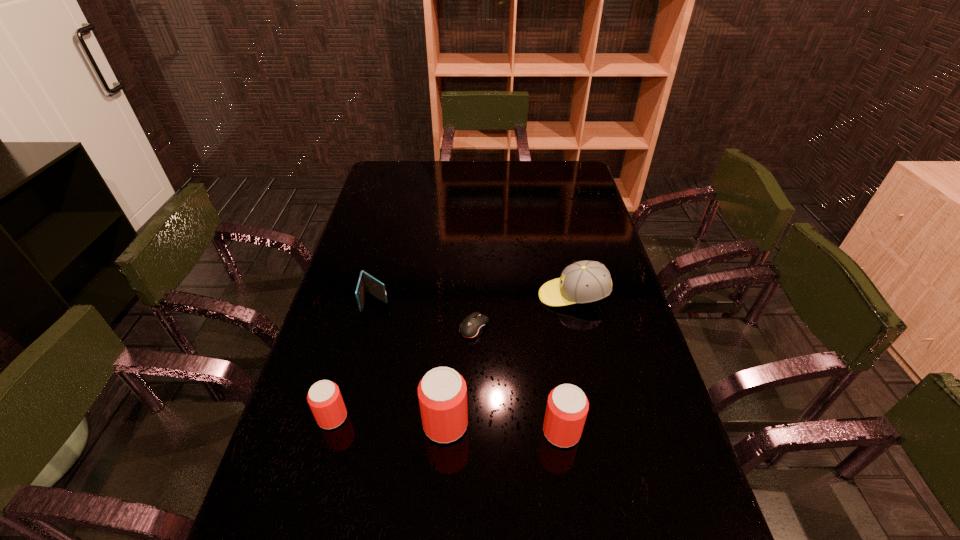
At what (x,y) coordinates should I click in order to perform the action: click on empty location between the wallet and the second tallest beer can. Please return your answer as a coordinate pair (x, y). Looking at the image, I should click on (468, 366).

Locate an element on the screen. The image size is (960, 540). vacant area between the second shortest beer can and the wallet is located at coordinates (468, 366).

Find the location of a particular element. The height and width of the screenshot is (540, 960). empty space that is in between the second shortest object and the baseball cap is located at coordinates pos(474,299).

Locate an element on the screen. This screenshot has height=540, width=960. empty location between the second beer can from left to right and the second shortest object is located at coordinates (411, 362).

At what (x,y) coordinates should I click in order to perform the action: click on blank region between the baseball cap and the fifth tallest object. Please return your answer as a coordinate pair (x, y). This screenshot has width=960, height=540. Looking at the image, I should click on (474, 299).

Where is `vacant space in between the baseball cap and the third farthest object`? The width and height of the screenshot is (960, 540). vacant space in between the baseball cap and the third farthest object is located at coordinates (524, 312).

Identify which object is located as the fifth nearest to the tallest beer can. Please provide its 2D coordinates. Your answer should be formatted as a tuple, i.e. [(x, y)], where the tuple contains the x and y coordinates of a point satisfying the conditions above.

[(582, 282)]

Select which object appears as the fourth closest to the shortest beer can. Please provide its 2D coordinates. Your answer should be formatted as a tuple, i.e. [(x, y)], where the tuple contains the x and y coordinates of a point satisfying the conditions above.

[(567, 406)]

In order to click on beer can that is the closest to the computer mouse in this screenshot , I will do `click(442, 392)`.

Locate an element on the screen. beer can that is the nearest to the shortest beer can is located at coordinates (442, 392).